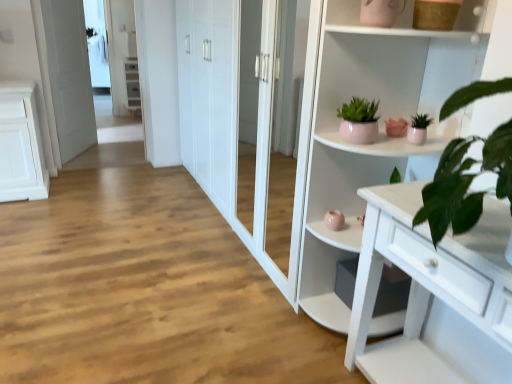
Describe the element at coordinates (418, 129) in the screenshot. The width and height of the screenshot is (512, 384). I see `pink ceramic houseplant at upper right, acting as the first houseplant starting from the right` at that location.

From the picture: What is the approximate height of white glossy door at left?

It is 1.54 meters.

Identify the location of matte pink pot at upper center, which appears as the 2th houseplant when viewed from the right. (359, 121).

The width and height of the screenshot is (512, 384). Find the location of `pink ceramic houseplant at upper right, acting as the first houseplant starting from the right`. pink ceramic houseplant at upper right, acting as the first houseplant starting from the right is located at coordinates click(418, 129).

Is white glossy door at left positioned in front of matte pink pot at upper center, the 1th houseplant from the left?

No, white glossy door at left is further to the viewer.

What's the angular difference between white glossy door at left and matte pink pot at upper center, the 1th houseplant from the left,'s facing directions?

The facing directions of white glossy door at left and matte pink pot at upper center, the 1th houseplant from the left, are 128 degrees apart.

Would you say white glossy door at left contains matte pink pot at upper center, which appears as the 2th houseplant when viewed from the right?

No.

Where is `screen door that appears on the left of matte pink pot at upper center, which appears as the 2th houseplant when viewed from the right`? The height and width of the screenshot is (384, 512). screen door that appears on the left of matte pink pot at upper center, which appears as the 2th houseplant when viewed from the right is located at coordinates (69, 76).

Is point (135, 70) farther from camera compared to point (425, 127)?

Yes, it is.

Is pink ceramic houseplant at upper right, acting as the first houseplant starting from the right, inside white glossy cabinet at upper left?

No, pink ceramic houseplant at upper right, acting as the first houseplant starting from the right, is not inside white glossy cabinet at upper left.

Which object is closer to the camera taking this photo, white glossy cabinet at upper left or pink ceramic houseplant at upper right, acting as the first houseplant starting from the right?

pink ceramic houseplant at upper right, acting as the first houseplant starting from the right.

In the scene shown: From a real-world perspective, relative to pink ceramic houseplant at upper right, arranged as the second houseplant when viewed from the left, is white glossy cabinet at upper left vertically above or below?

Clearly, from a real-world perspective, white glossy cabinet at upper left is below pink ceramic houseplant at upper right, arranged as the second houseplant when viewed from the left.

Is white glossy door at left next to white glossy cupboard at upper right?

white glossy door at left and white glossy cupboard at upper right are not in contact.

Which is nearer, (79, 97) or (385, 177)?

Point (79, 97) is farther from the camera than point (385, 177).

Is white glossy door at left to the left or to the right of white glossy cupboard at upper right in the image?

From the image, it's evident that white glossy door at left is to the left of white glossy cupboard at upper right.

Considering the sizes of objects white glossy door at left and white glossy cupboard at upper right in the image provided, who is thinner, white glossy door at left or white glossy cupboard at upper right?

white glossy door at left.

I want to click on the 2nd houseplant below the white glossy cabinet at upper left (from the image's perspective), so click(x=418, y=129).

Is pink ceramic houseplant at upper right, acting as the first houseplant starting from the right, to the left or to the right of white glossy cabinet at upper left in the image?

pink ceramic houseplant at upper right, acting as the first houseplant starting from the right, is to the right of white glossy cabinet at upper left.

Is pink ceramic houseplant at upper right, arranged as the second houseplant when viewed from the left, in contact with white glossy cabinet at upper left?

No, pink ceramic houseplant at upper right, arranged as the second houseplant when viewed from the left, is not touching white glossy cabinet at upper left.

Is matte pink pot at upper center, which appears as the 2th houseplant when viewed from the right, closer to the viewer compared to white glossy cabinet at upper left?

That is True.

From a real-world perspective, which object stands above the other?

matte pink pot at upper center, which appears as the 2th houseplant when viewed from the right, is physically above.

Does matte pink pot at upper center, which appears as the 2th houseplant when viewed from the right, touch white glossy cabinet at upper left?

No, matte pink pot at upper center, which appears as the 2th houseplant when viewed from the right, is not with white glossy cabinet at upper left.

Is white glossy cupboard at upper right positioned in front of white glossy cabinet at upper left?

Yes, the depth of white glossy cupboard at upper right is less than that of white glossy cabinet at upper left.

Is white glossy cupboard at upper right not within white glossy cabinet at upper left?

white glossy cupboard at upper right lies outside white glossy cabinet at upper left's area.

Who is bigger, white glossy cupboard at upper right or white glossy cabinet at upper left?

white glossy cupboard at upper right.

From a real-world perspective, between white glossy cupboard at upper right and white glossy cabinet at upper left, who is vertically lower?

white glossy cabinet at upper left.

Is point (362, 101) positioned before point (425, 138)?

No, it is behind (425, 138).

From the picture: Measure the distance between matte pink pot at upper center, the 1th houseplant from the left, and pink ceramic houseplant at upper right, acting as the first houseplant starting from the right.

They are 8.55 inches apart.

Who is smaller, matte pink pot at upper center, the 1th houseplant from the left, or pink ceramic houseplant at upper right, arranged as the second houseplant when viewed from the left?

With smaller size is pink ceramic houseplant at upper right, arranged as the second houseplant when viewed from the left.

Is matte pink pot at upper center, which appears as the 2th houseplant when viewed from the right, situated inside pink ceramic houseplant at upper right, acting as the first houseplant starting from the right, or outside?

matte pink pot at upper center, which appears as the 2th houseplant when viewed from the right, is not enclosed by pink ceramic houseplant at upper right, acting as the first houseplant starting from the right.

You are a GUI agent. You are given a task and a screenshot of the screen. Output one action in this format:
    pyautogui.click(x=<x>, y=<y>)
    Task: Click on the screen door on the left of matte pink pot at upper center, the 1th houseplant from the left
    The image size is (512, 384).
    Given the screenshot: What is the action you would take?
    pos(69,76)

Find the location of a particular element. cabinet above the pink ceramic houseplant at upper right, arranged as the second houseplant when viewed from the left (from the image's perspective) is located at coordinates (131, 84).

Consider the image. Considering their positions, is white glossy cupboard at upper right positioned further to white glossy cabinet at upper left than white glossy door at left?

white glossy cupboard at upper right lies further to white glossy cabinet at upper left than the other object.

Considering their positions, is white glossy door at left positioned closer to pink ceramic houseplant at upper right, acting as the first houseplant starting from the right, than matte pink pot at upper center, which appears as the 2th houseplant when viewed from the right?

matte pink pot at upper center, which appears as the 2th houseplant when viewed from the right, lies closer to pink ceramic houseplant at upper right, acting as the first houseplant starting from the right, than the other object.

Estimate the real-world distances between objects in this image. Which object is closer to matte pink pot at upper center, the 1th houseplant from the left, white glossy cupboard at upper right or white glossy cabinet at upper left?

white glossy cupboard at upper right.

Considering their positions, is white glossy cabinet at upper left positioned closer to pink ceramic houseplant at upper right, arranged as the second houseplant when viewed from the left, than white glossy door at left?

white glossy door at left is positioned closer to the anchor pink ceramic houseplant at upper right, arranged as the second houseplant when viewed from the left.

Considering their positions, is white glossy cupboard at upper right positioned closer to white glossy cabinet at upper left than pink ceramic houseplant at upper right, arranged as the second houseplant when viewed from the left?

white glossy cupboard at upper right lies closer to white glossy cabinet at upper left than the other object.

When comparing their distances from matte pink pot at upper center, which appears as the 2th houseplant when viewed from the right, does pink ceramic houseplant at upper right, arranged as the second houseplant when viewed from the left, or white glossy cupboard at upper right seem closer?

Among the two, pink ceramic houseplant at upper right, arranged as the second houseplant when viewed from the left, is located nearer to matte pink pot at upper center, which appears as the 2th houseplant when viewed from the right.

When comparing their distances from white glossy cabinet at upper left, does pink ceramic houseplant at upper right, acting as the first houseplant starting from the right, or white glossy door at left seem further?

The object further to white glossy cabinet at upper left is pink ceramic houseplant at upper right, acting as the first houseplant starting from the right.

Estimate the real-world distances between objects in this image. Which object is closer to white glossy door at left, white glossy cupboard at upper right or pink ceramic houseplant at upper right, acting as the first houseplant starting from the right?

white glossy cupboard at upper right.

The image size is (512, 384). In order to click on houseplant between matte pink pot at upper center, the 1th houseplant from the left, and white glossy cabinet at upper left in the front-back direction in this screenshot , I will do `click(418, 129)`.

Locate an element on the screen. houseplant situated between white glossy door at left and white glossy cupboard at upper right from left to right is located at coordinates (359, 121).

Image resolution: width=512 pixels, height=384 pixels. Find the location of `houseplant between white glossy cupboard at upper right and pink ceramic houseplant at upper right, arranged as the second houseplant when viewed from the left, in the front-back direction`. houseplant between white glossy cupboard at upper right and pink ceramic houseplant at upper right, arranged as the second houseplant when viewed from the left, in the front-back direction is located at coordinates (359, 121).

Find the location of a particular element. This screenshot has height=384, width=512. cupboard between white glossy door at left and pink ceramic houseplant at upper right, arranged as the second houseplant when viewed from the left, from left to right is located at coordinates (379, 125).